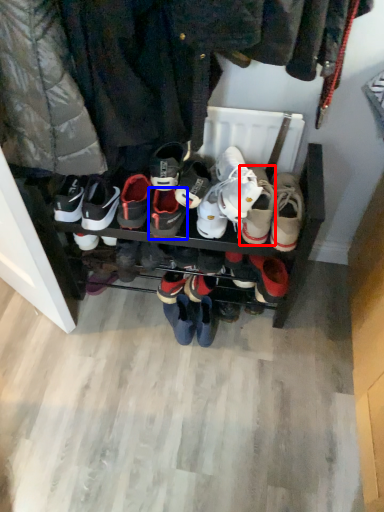
Question: Which of the following is the closest to the observer, footwear (highlighted by a red box) or footwear (highlighted by a blue box)?

Choices:
 (A) footwear
 (B) footwear

Answer: (A)